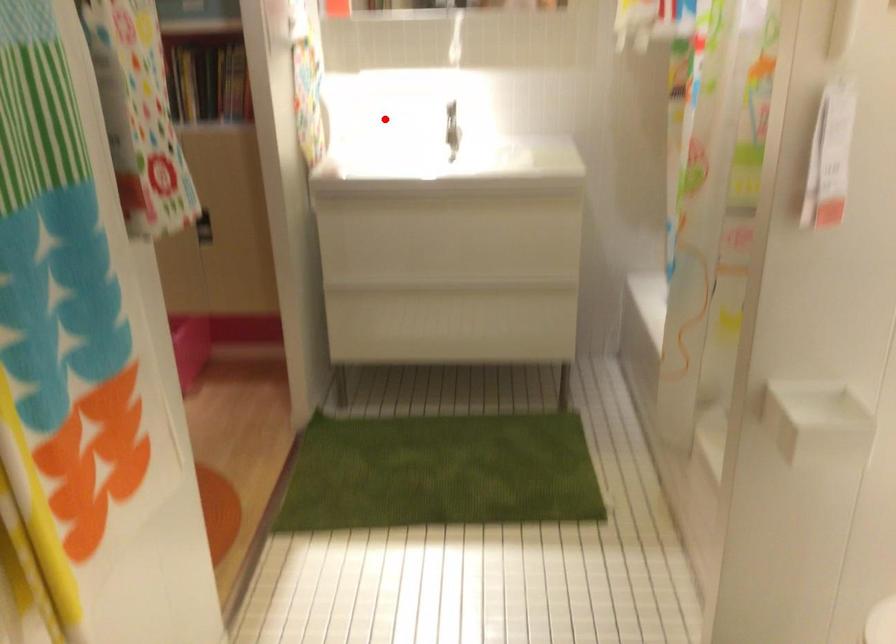
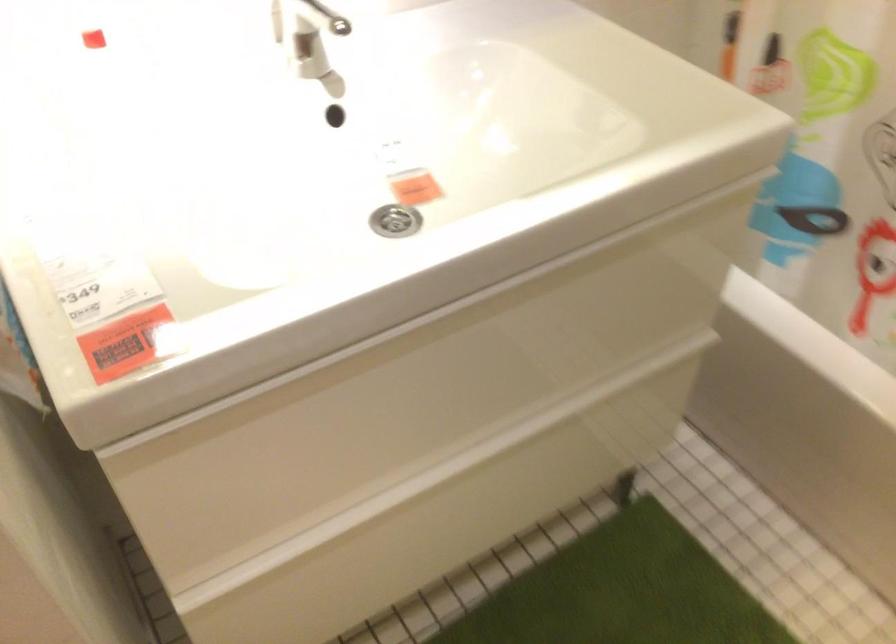
Question: I am providing you with two images of the same scene from different viewpoints. Image1 has a red point marked. In image2, the corresponding 3D location appears at what relative position? Reply with the corresponding letter.

Choices:
 (A) Closer
 (B) Farther

Answer: (A)